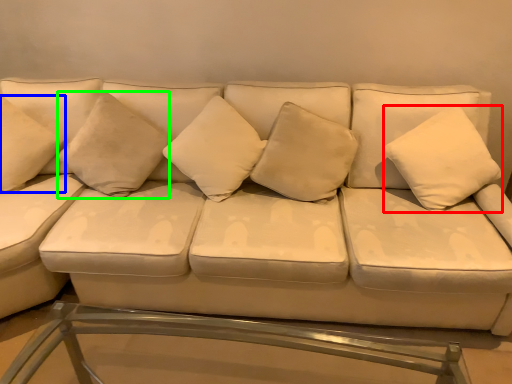
Question: Which object is the closest to the pillow (highlighted by a red box)? Choose among these: pillow (highlighted by a blue box) or pillow (highlighted by a green box).

Choices:
 (A) pillow
 (B) pillow

Answer: (B)